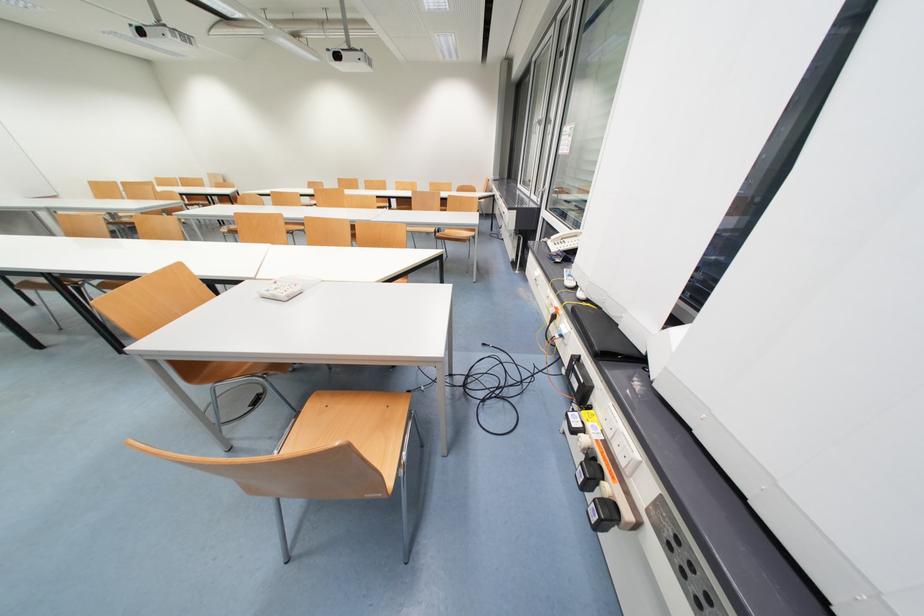
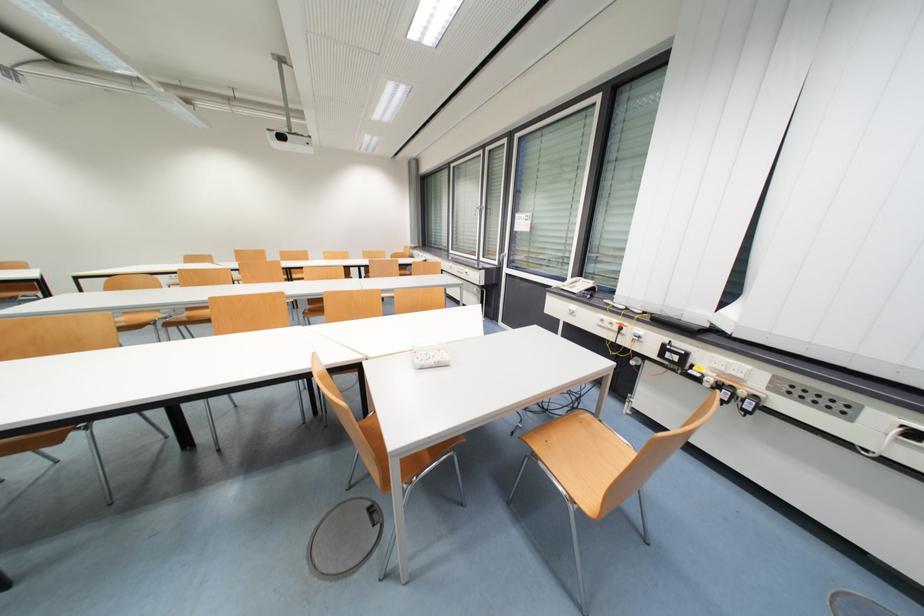
In the second image, find the point that corresponds to the point at 343,59 in the first image.

(286, 139)